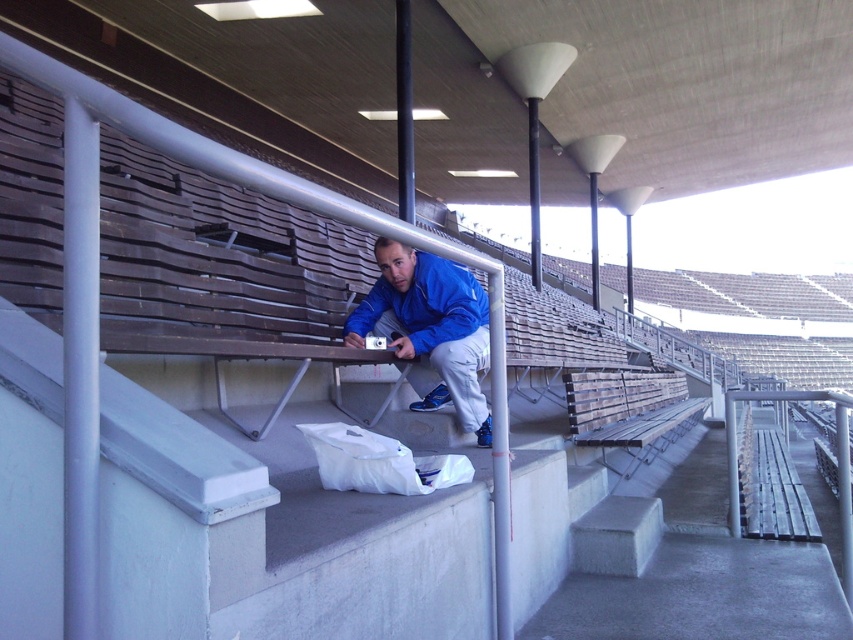
You are sitting on the wooden bench at center and want to hand a snack to the person in the blue fabric jacket at center. Can you reach them without getting up?

The blue fabric jacket at center is closer to the viewer than the wooden bench at center, so you can reach them without getting up because they are in front of you.

You are a spectator at the stadium and need to place your blue fabric jacket at center on the wooden bench at center. Will the jacket fit on the bench?

The blue fabric jacket at center has a smaller size compared to wooden bench at center, so the jacket will fit on the bench.